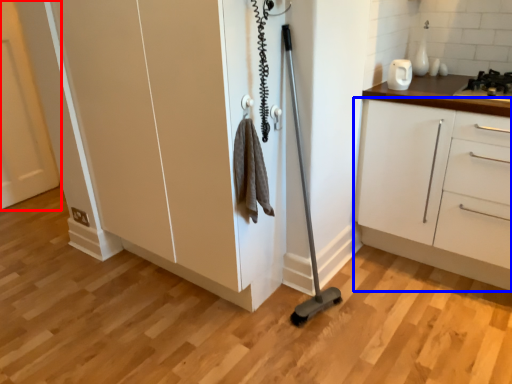
Question: Among these objects, which one is farthest to the camera, door (highlighted by a red box) or cabinetry (highlighted by a blue box)?

Choices:
 (A) door
 (B) cabinetry

Answer: (A)